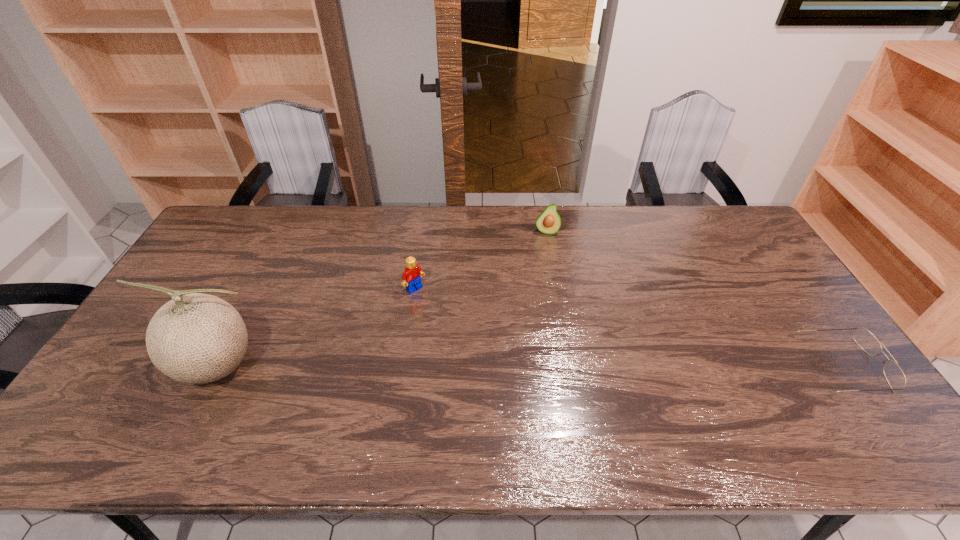
You are a GUI agent. You are given a task and a screenshot of the screen. Output one action in this format:
    pyautogui.click(x=<x>, y=<y>)
    Task: Click on the vacant space that satisfies the following two spatial constraints: 1. on the front side of the second farthest object; 2. on the front-facing side of the rightmost object
    
    Given the screenshot: What is the action you would take?
    (x=403, y=366)